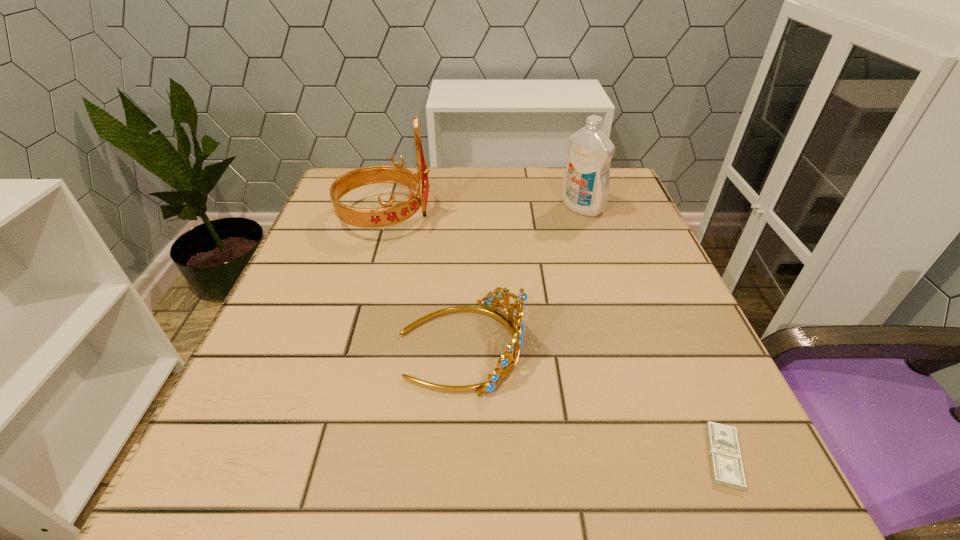
Image resolution: width=960 pixels, height=540 pixels. I want to click on tiara at the far edge, so click(389, 214).

Find the location of a particular element. detergent that is at the far edge is located at coordinates (585, 189).

This screenshot has height=540, width=960. I want to click on object that is at the near edge, so click(727, 469).

This screenshot has width=960, height=540. I want to click on object present at the left edge, so click(389, 214).

Image resolution: width=960 pixels, height=540 pixels. I want to click on detergent that is at the right edge, so click(585, 189).

You are a GUI agent. You are given a task and a screenshot of the screen. Output one action in this format:
    pyautogui.click(x=<x>, y=<y>)
    Task: Click on the money at the right edge
    Image resolution: width=960 pixels, height=540 pixels.
    Given the screenshot: What is the action you would take?
    pyautogui.click(x=727, y=469)

The width and height of the screenshot is (960, 540). What are the coordinates of `object that is at the far left corner` in the screenshot? It's located at (389, 214).

This screenshot has height=540, width=960. Identify the location of object that is at the far right corner. (585, 189).

Where is `object positioned at the near right corner`? object positioned at the near right corner is located at coordinates (727, 469).

In the image, there is a desktop. What are the coordinates of `vacant area at the far edge` in the screenshot? It's located at (544, 201).